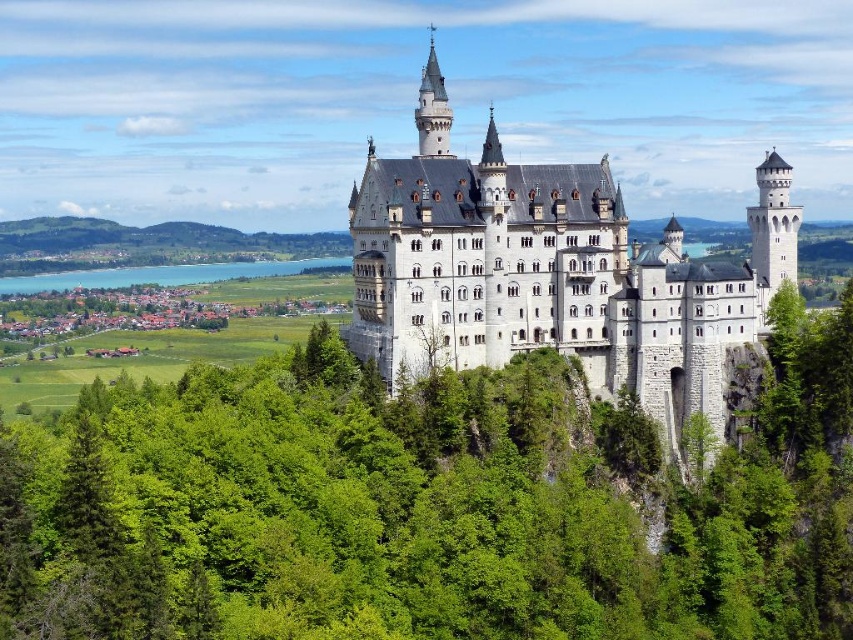
Looking at this image, you are an architect examining the castle grounds. You notice the green leafy tree at center and the white stone castle at center. From the perspective of someone standing in front of the castle, which object is located to the left?

The green leafy tree at center is positioned on the left side of the white stone castle at center, so from the perspective of someone standing in front of the castle, the green leafy tree at center is located to the left.

You are standing in front of the castle and notice two points marked on the image. One is at coordinate point (659, 380) and the other at point (0, 284). Which point is nearer to you?

Point (659, 380) is closer to the viewer than point (0, 284).